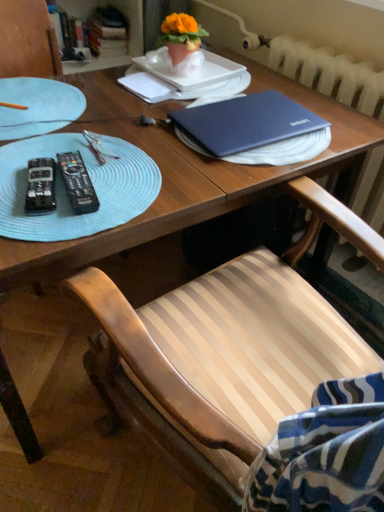
Where is `vacant area that lies between black plastic remote control at left, which is counted as the second remote control, starting from the left, and light blue textured glass plate at left, the 1th glass plate in the top-to-bottom sequence`? vacant area that lies between black plastic remote control at left, which is counted as the second remote control, starting from the left, and light blue textured glass plate at left, the 1th glass plate in the top-to-bottom sequence is located at coordinates (57, 153).